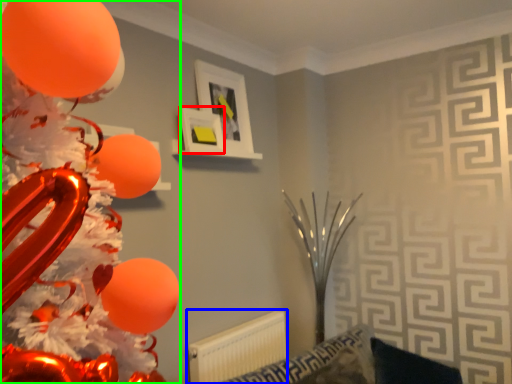
Question: Based on their relative distances, which object is nearer to picture frame (highlighted by a red box)? Choose from radiator (highlighted by a blue box) and balloon (highlighted by a green box).

Choices:
 (A) radiator
 (B) balloon

Answer: (A)